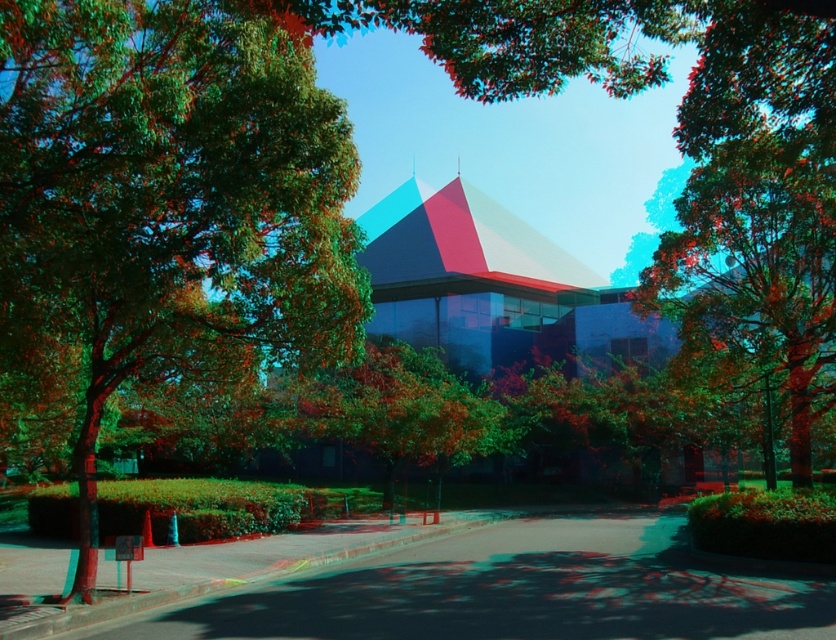
You are a pedestrian standing on the sidewalk in front of the modern building. You notice two green leafy trees. Which tree, the green leafy tree at left or the green leafy tree at center, is closer to you?

The green leafy tree at left is closer to you because it is smaller than the green leafy tree at center, indicating it is nearer due to perspective.

You are standing on the sidewalk in front of the modern building. You notice two green leafy trees. Which tree, the green leafy tree at left or the green leafy tree at center, is closer to you?

The green leafy tree at left is closer to you because it is in front of the green leafy tree at center.